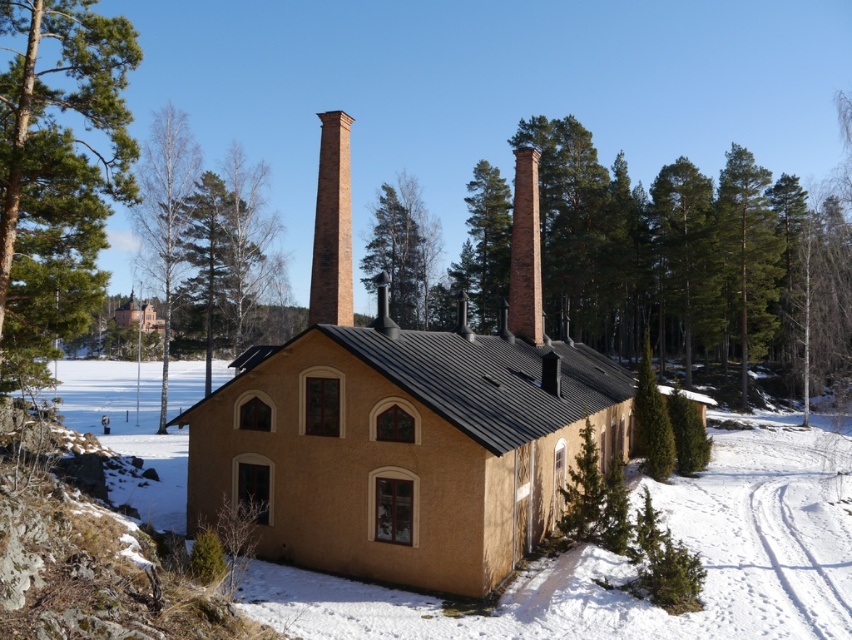
How distant is white powdery snow at lower center from green leafy tree at left?

The distance of white powdery snow at lower center from green leafy tree at left is 16.09 meters.

Which is more to the right, white powdery snow at lower center or green leafy tree at left?

From the viewer's perspective, green leafy tree at left appears more on the right side.

Where is `white powdery snow at lower center`? Image resolution: width=852 pixels, height=640 pixels. white powdery snow at lower center is located at coordinates tap(632, 566).

This screenshot has width=852, height=640. What are the coordinates of `white powdery snow at lower center` in the screenshot? It's located at (632, 566).

Is point (755, 401) closer to camera compared to point (372, 246)?

That is True.

Is brown brick chimney at upper center smaller than green leafy tree at center?

Incorrect, brown brick chimney at upper center is not smaller in size than green leafy tree at center.

This screenshot has width=852, height=640. Describe the element at coordinates (695, 260) in the screenshot. I see `brown brick chimney at upper center` at that location.

At what (x,y) coordinates should I click in order to perform the action: click on brown brick chimney at upper center. Please return your answer as a coordinate pair (x, y). The height and width of the screenshot is (640, 852). Looking at the image, I should click on (695, 260).

Who is more distant from viewer, (404,637) or (524,324)?

Positioned behind is point (524,324).

Image resolution: width=852 pixels, height=640 pixels. What are the coordinates of `white powdery snow at lower center` in the screenshot? It's located at (632, 566).

This screenshot has width=852, height=640. I want to click on white powdery snow at lower center, so click(x=632, y=566).